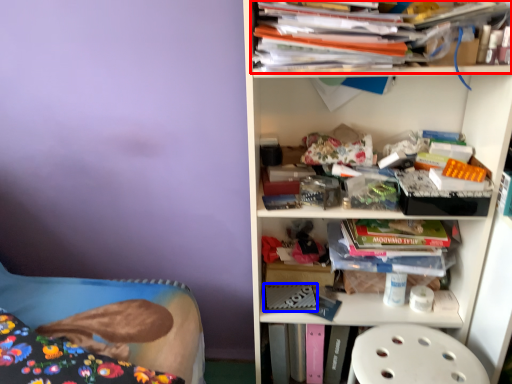
Question: Which object appears farthest to the camera in this image, book (highlighted by a red box) or paperback book (highlighted by a blue box)?

Choices:
 (A) book
 (B) paperback book

Answer: (B)